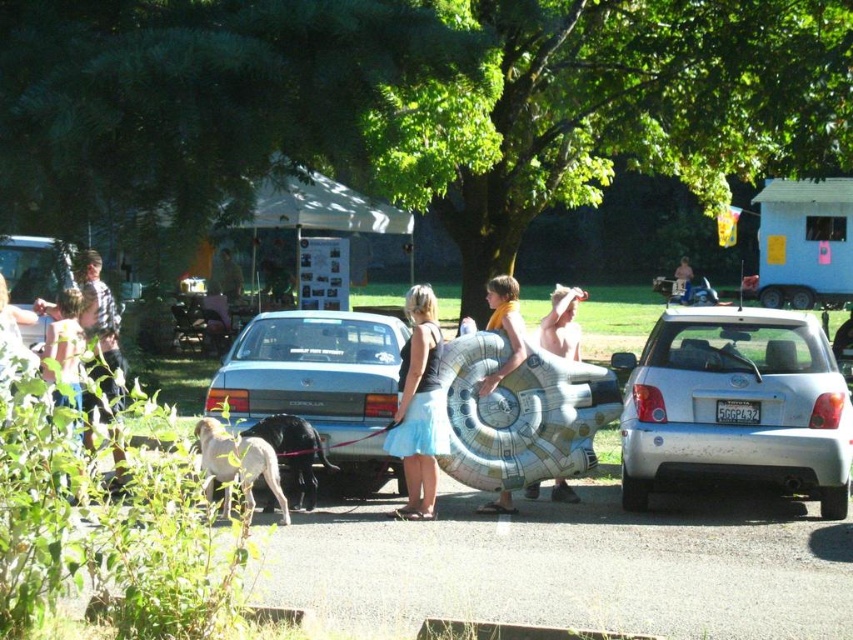
You are a delivery person who needs to place a package between the matte silver car at center and the black rubber tire at rear right. The package requires a minimum of 30 meters of space to be placed safely. Can you safely place the package there?

The distance between the matte silver car at center and the black rubber tire at rear right is 28.39 meters, which is less than the required 30 meters. Therefore, you cannot safely place the package there.

You are a pedestrian standing at the edge of the paved area looking towards the center. Which object is closer to you between the matte silver car at center and the black fur dog at center?

The black fur dog at center is closer to you because the matte silver car at center is positioned to its right, meaning the dog is nearer to your viewpoint.